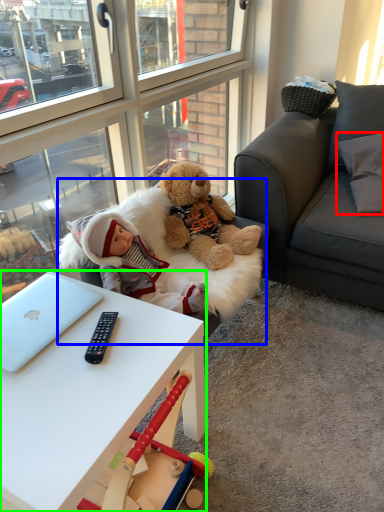
Question: Estimate the real-world distances between objects in this image. Which object is closer to pillow (highlighted by a red box), swivel chair (highlighted by a blue box) or desk (highlighted by a green box)?

Choices:
 (A) swivel chair
 (B) desk

Answer: (A)